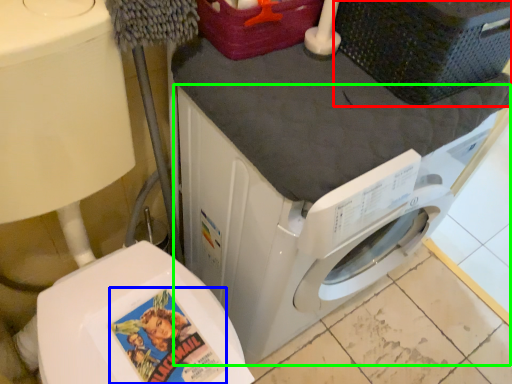
Question: Which is farther away from basket (highlighted by a red box)? comic book character (highlighted by a blue box) or washing machine (highlighted by a green box)?

Choices:
 (A) comic book character
 (B) washing machine

Answer: (A)